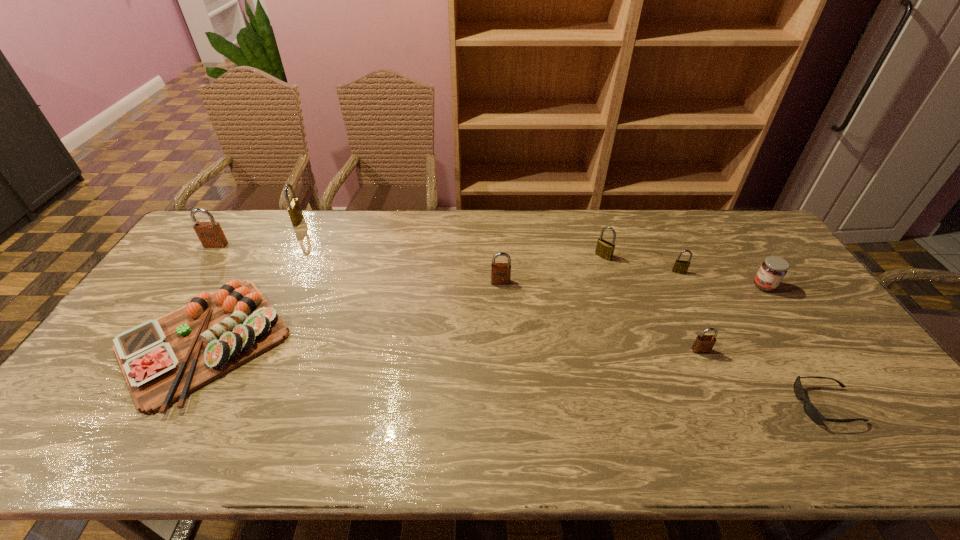
This screenshot has width=960, height=540. What are the coordinates of `empty space that is in between the fifth padlock from right to left and the jam` in the screenshot? It's located at (531, 253).

Identify the location of free space that is in between the seventh object from left to right and the leftmost brass padlock. This screenshot has height=540, width=960. (489, 246).

I want to click on blank region between the second nearest brass padlock and the rightmost brown padlock, so coord(652,303).

Where is `blank region between the eighth nearest object and the jam`? The width and height of the screenshot is (960, 540). blank region between the eighth nearest object and the jam is located at coordinates (490, 266).

Locate an element on the screen. The height and width of the screenshot is (540, 960). vacant region between the farthest brown padlock and the platter is located at coordinates (210, 293).

This screenshot has height=540, width=960. I want to click on free space between the second padlock from right to left and the jam, so click(732, 318).

You are a GUI agent. You are given a task and a screenshot of the screen. Output one action in this format:
    pyautogui.click(x=<x>, y=<y>)
    Task: Click on the closest object to the farthest brown padlock
    
    Given the screenshot: What is the action you would take?
    pyautogui.click(x=163, y=360)

At what (x,y) coordinates should I click in order to perform the action: click on the sixth closest object to the fifth nearest padlock. Please return your answer as a coordinate pair (x, y). The width and height of the screenshot is (960, 540). Looking at the image, I should click on (703, 343).

Find the location of a particular element. The height and width of the screenshot is (540, 960). padlock that is the sixth closest to the shortest object is located at coordinates (210, 234).

Identify which padlock is located as the nearest to the second farthest padlock. Please provide its 2D coordinates. Your answer should be formatted as a tuple, i.e. [(x, y)], where the tuple contains the x and y coordinates of a point satisfying the conditions above.

[(294, 209)]